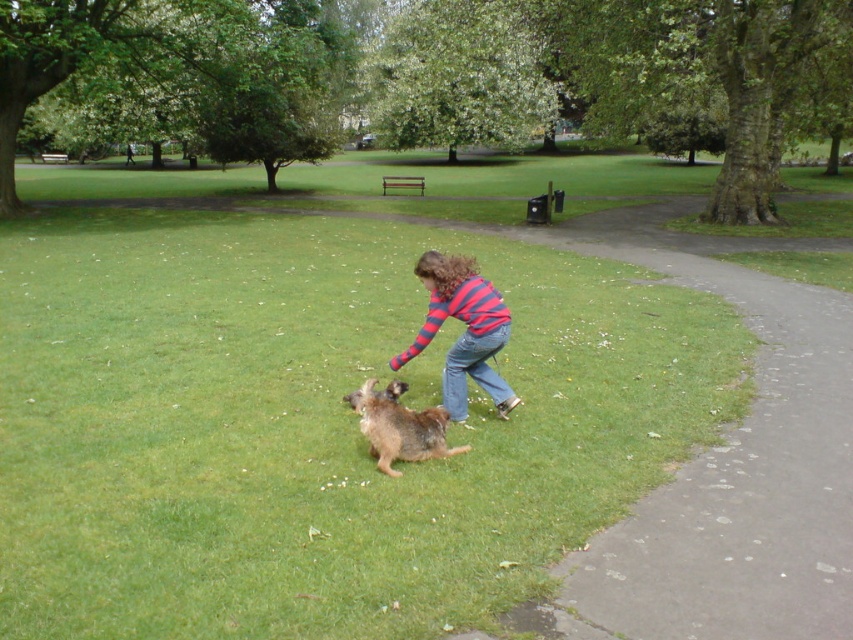
From the picture: You are a photographer planning to capture a candid shot of the striped cotton shirt at center and the brown shaggy dog at center. Based on their sizes, which one should you focus on to ensure it fills more of the frame?

The striped cotton shirt at center has a larger size compared to the brown shaggy dog at center, so focusing on the striped cotton shirt at center will fill more of the frame.

You are a photographer trying to capture a candid shot of the striped cotton shirt at center and the brown shaggy dog at center. Since you want to focus on the dog, should you adjust your camera to focus on the background or foreground?

The brown shaggy dog at center is behind the striped cotton shirt at center, so you should adjust your camera to focus on the background to capture the dog clearly.